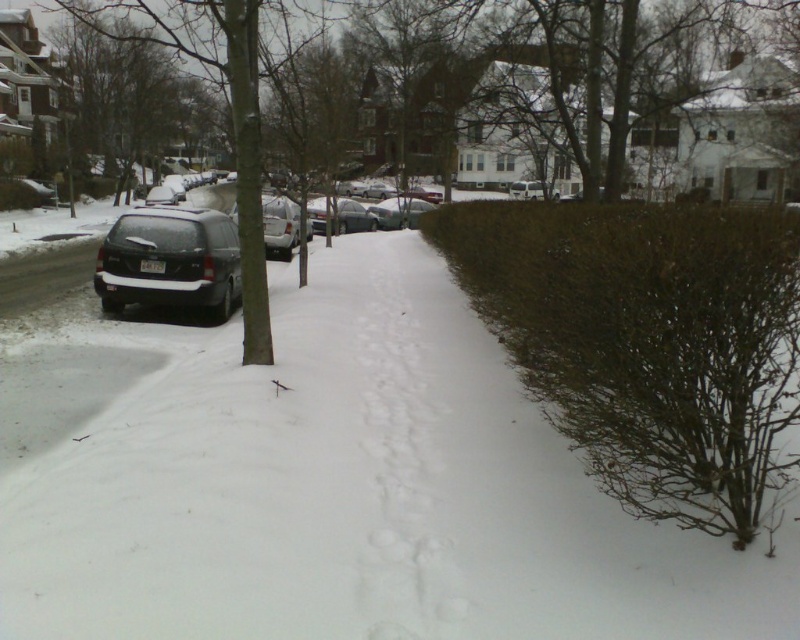
Consider the image. Who is higher up, green textured tree at left or sleek silver sedan at center?

green textured tree at left

Does green textured tree at left come in front of sleek silver sedan at center?

Yes, it is in front of sleek silver sedan at center.

Looking at this image, who is more forward, (256, 108) or (368, 205)?

Point (256, 108) is in front.

Identify the location of green textured tree at left. This screenshot has height=640, width=800. (229, 104).

Is brown textured hedge at right smaller than sleek silver sedan at center?

No, brown textured hedge at right is not smaller than sleek silver sedan at center.

Looking at this image, does brown textured hedge at right come in front of sleek silver sedan at center?

Yes, it is in front of sleek silver sedan at center.

Is point (746, 218) positioned before point (380, 209)?

Yes.

Find the location of a particular element. The height and width of the screenshot is (640, 800). brown textured hedge at right is located at coordinates (648, 342).

Does brown textured hedge at right have a greater height compared to green textured tree at left?

In fact, brown textured hedge at right may be shorter than green textured tree at left.

Does brown textured hedge at right have a lesser height compared to green textured tree at left?

Correct, brown textured hedge at right is not as tall as green textured tree at left.

At what (x,y) coordinates should I click in order to perform the action: click on brown textured hedge at right. Please return your answer as a coordinate pair (x, y). The height and width of the screenshot is (640, 800). Looking at the image, I should click on (648, 342).

Identify the location of brown textured hedge at right. (648, 342).